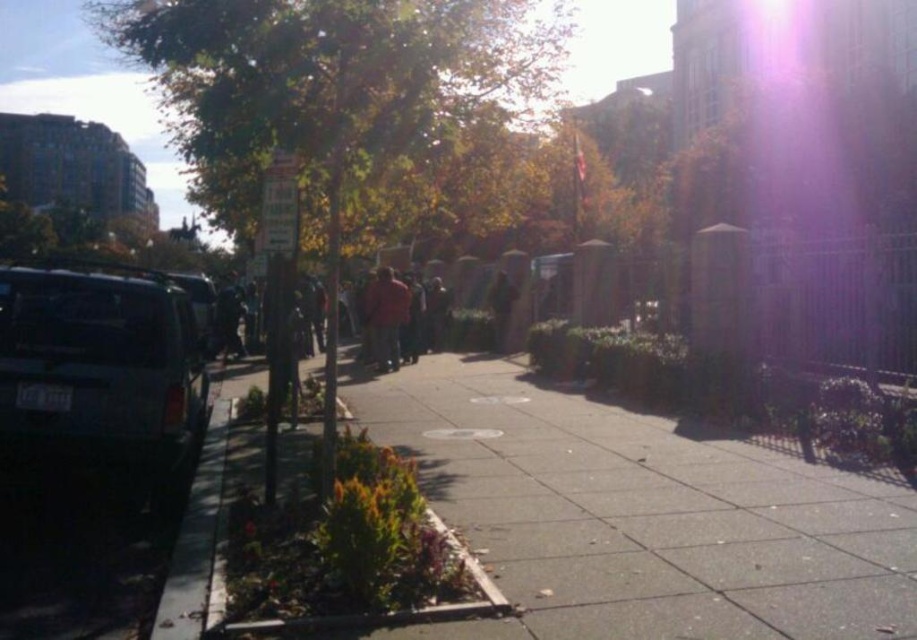
You are a delivery person who needs to park your 4.5 meter long matte black suv at left in a parking spot that is 5 meters long. The parking spot is located near the green leafy tree at left. Is there enough space for the suv to fit in the parking spot?

The parking spot is 5 meters long, and the matte black suv at left is 4.5 meters long. Since 5 meters is longer than 4.5 meters, the suv can fit in the parking spot.

You are a delivery person trying to cross the street. You see a green leafy tree at left and a black rubber curb at lower left. Which object is closer to you, the delivery person?

The green leafy tree at left is closer to you than the black rubber curb at lower left because it is further to the viewer.

In the scene shown: You are a delivery person with a 1.2 meter wide cart. You need to navigate through the sidewalk between the green leafy tree at left and the black rubber curb at lower left. Can your cart fit through the space between them?

The green leafy tree at left might be wider than the black rubber curb at lower left, so the space between them may not be wide enough for your 1.2 meter wide cart. You should check the actual width before proceeding.